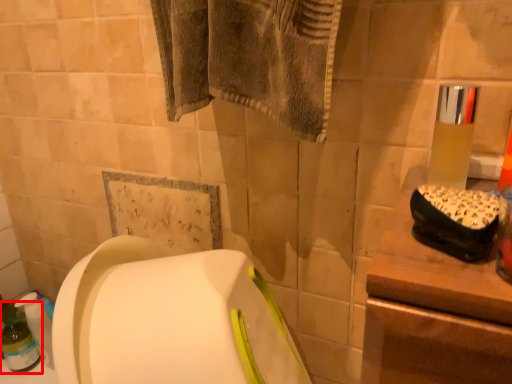
Question: From the image's perspective, where is bottle (annotated by the red box) located in relation to mouthwash in the image?

Choices:
 (A) above
 (B) below

Answer: (B)